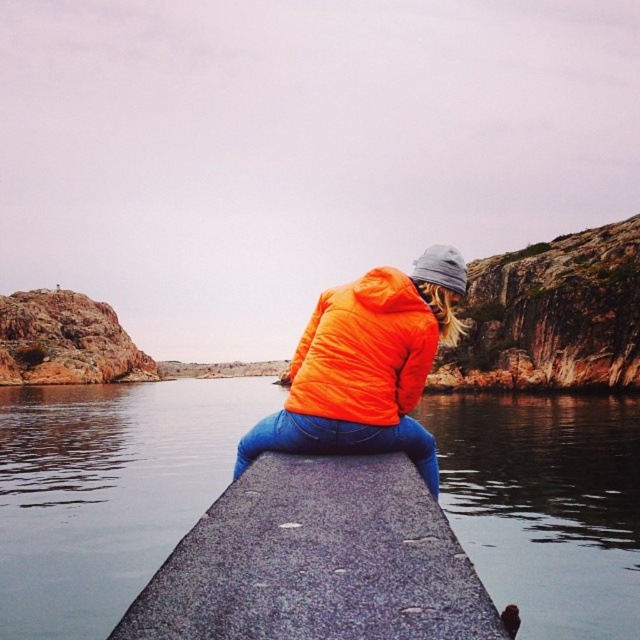
Based on the coordinates provided in the scene description, where is the smooth dark water at dock center located in the image?

The smooth dark water at dock center is located at the 2D coordinates point (x=106, y=492).

You are standing on the pier and want to sit down. There is a gray speckled concrete at center and an orange matte jacket at center. Which object is suitable for sitting?

The gray speckled concrete at center is positioned under orange matte jacket at center, so the gray speckled concrete at center is the surface where the jacket is sitting. Since the jacket is already on the concrete, the concrete is the suitable place to sit.

Based on the scene description, where is the smooth dark water at dock center located in the image?

The smooth dark water at dock center is located at point coordinates of 0.769 on the x axis and 0.167 on the y axis.